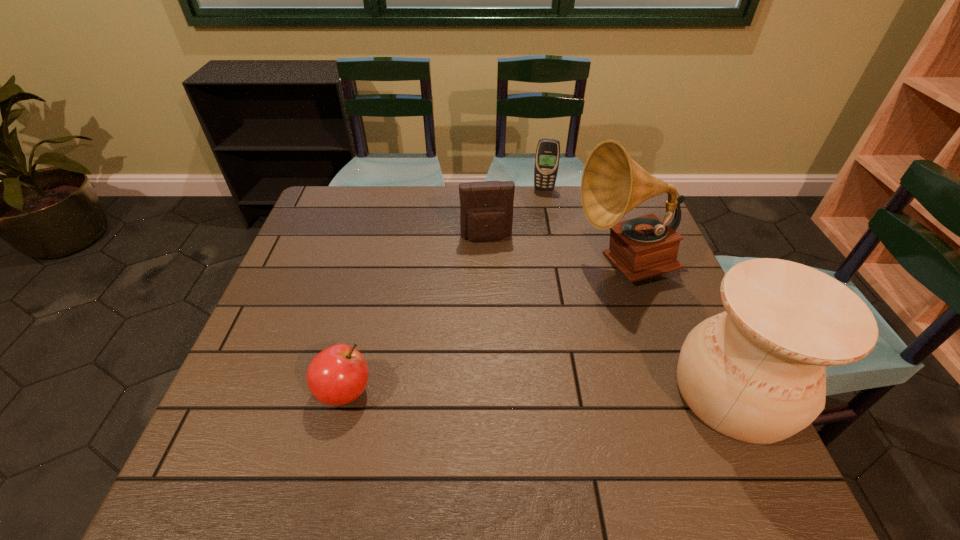
You are a GUI agent. You are given a task and a screenshot of the screen. Output one action in this format:
    pyautogui.click(x=<x>, y=<y>)
    Task: Click on the pottery present at the right edge
    This screenshot has height=540, width=960.
    Given the screenshot: What is the action you would take?
    pyautogui.click(x=756, y=373)

Where is `phonograph record at the right edge`? The image size is (960, 540). phonograph record at the right edge is located at coordinates (612, 184).

The height and width of the screenshot is (540, 960). What are the coordinates of `object present at the near right corner` in the screenshot? It's located at (756, 373).

Identify the location of free space at the far edge. The height and width of the screenshot is (540, 960). (454, 198).

At what (x,y) coordinates should I click in order to perform the action: click on free spot at the near edge of the desktop. Please return your answer as a coordinate pair (x, y). Looking at the image, I should click on (561, 402).

Where is `free location at the left edge`? This screenshot has width=960, height=540. free location at the left edge is located at coordinates (314, 269).

You are a GUI agent. You are given a task and a screenshot of the screen. Output one action in this format:
    pyautogui.click(x=<x>, y=<y>)
    Task: Click on the blank space at the right edge of the desktop
    The width and height of the screenshot is (960, 540).
    Given the screenshot: What is the action you would take?
    pyautogui.click(x=606, y=242)

You are a GUI agent. You are given a task and a screenshot of the screen. Output one action in this format:
    pyautogui.click(x=<x>, y=<y>)
    Task: Click on the vacant area that lies between the farthest object and the pottery
    This screenshot has width=960, height=540.
    Given the screenshot: What is the action you would take?
    pyautogui.click(x=638, y=291)

The width and height of the screenshot is (960, 540). Find the location of `empty space between the fourth shortest object and the phonograph record`. empty space between the fourth shortest object and the phonograph record is located at coordinates (678, 328).

The height and width of the screenshot is (540, 960). Find the location of `free space between the phonograph record and the third object from left to right`. free space between the phonograph record and the third object from left to right is located at coordinates (584, 227).